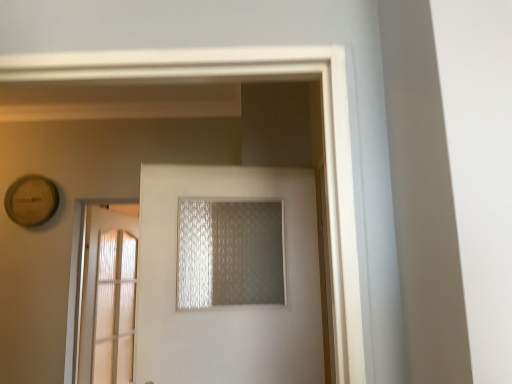
Question: Can you confirm if translucent textured glass at center is taller than clear glass door at left, which is counted as the second door, starting from the front?

Choices:
 (A) yes
 (B) no

Answer: (B)

Question: From the image's perspective, is translucent textured glass at center under clear glass door at left, marked as the 1th door in a left-to-right arrangement?

Choices:
 (A) yes
 (B) no

Answer: (B)

Question: Considering the relative sizes of translucent textured glass at center and clear glass door at left, the first door in the back-to-front sequence, in the image provided, is translucent textured glass at center smaller than clear glass door at left, the first door in the back-to-front sequence,?

Choices:
 (A) no
 (B) yes

Answer: (B)

Question: Considering the relative positions of translucent textured glass at center and clear glass door at left, the first door in the back-to-front sequence, in the image provided, is translucent textured glass at center to the right of clear glass door at left, the first door in the back-to-front sequence, from the viewer's perspective?

Choices:
 (A) yes
 (B) no

Answer: (A)

Question: From the image's perspective, is translucent textured glass at center located above clear glass door at left, which is counted as the second door, starting from the front?

Choices:
 (A) yes
 (B) no

Answer: (A)

Question: Would you consider translucent textured glass at center to be distant from clear glass door at left, which is counted as the second door, starting from the front?

Choices:
 (A) no
 (B) yes

Answer: (B)

Question: From a real-world perspective, is white frosted glass door at center, the second door from the back, on top of clear glass door at left, marked as the 1th door in a left-to-right arrangement?

Choices:
 (A) no
 (B) yes

Answer: (B)

Question: Is white frosted glass door at center, which is counted as the first door, starting from the right, positioned far away from clear glass door at left, marked as the 1th door in a left-to-right arrangement?

Choices:
 (A) yes
 (B) no

Answer: (A)

Question: From the image's perspective, would you say white frosted glass door at center, the second door from the back, is shown under clear glass door at left, the first door in the back-to-front sequence?

Choices:
 (A) yes
 (B) no

Answer: (B)

Question: Is white frosted glass door at center, which is counted as the first door, starting from the right, not inside clear glass door at left, the first door in the back-to-front sequence?

Choices:
 (A) no
 (B) yes

Answer: (B)

Question: Can you see white frosted glass door at center, which is the second door from left to right, touching clear glass door at left, which is counted as the second door, starting from the front?

Choices:
 (A) no
 (B) yes

Answer: (A)

Question: Is white frosted glass door at center, which is counted as the first door, starting from the right, oriented towards clear glass door at left, which is counted as the second door, starting from the front?

Choices:
 (A) yes
 (B) no

Answer: (B)

Question: Is translucent textured glass at center at the right side of white frosted glass door at center, which is the second door from left to right?

Choices:
 (A) yes
 (B) no

Answer: (A)